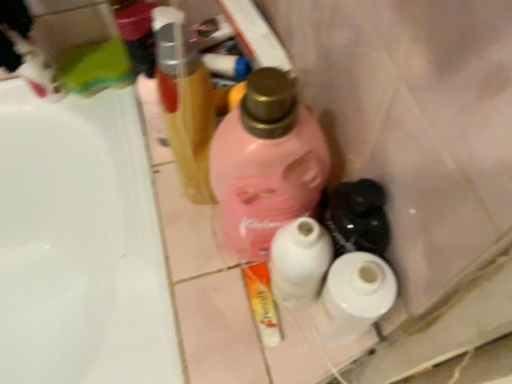
Identify the location of white matte toilet paper at center, acting as the first toilet paper starting from the right. (354, 296).

What do you see at coordinates (80, 245) in the screenshot? I see `white glossy sink at left` at bounding box center [80, 245].

The height and width of the screenshot is (384, 512). What do you see at coordinates (186, 108) in the screenshot? I see `metallic gold hairbrush at upper center, the second bottle positioned from the right` at bounding box center [186, 108].

Locate an element on the screen. metallic gold hairbrush at upper center, which appears as the 1th bottle when viewed from the left is located at coordinates (186, 108).

This screenshot has height=384, width=512. Describe the element at coordinates (266, 163) in the screenshot. I see `pink matte bottle at center, positioned as the 2th bottle in left-to-right order` at that location.

Identify the location of white matte toilet paper at center, the 1th toilet paper when ordered from left to right. The image size is (512, 384). (298, 262).

You are a GUI agent. You are given a task and a screenshot of the screen. Output one action in this format:
    pyautogui.click(x=<x>, y=<y>)
    Task: Click on the white glossy tube at center
    
    Given the screenshot: What is the action you would take?
    pyautogui.click(x=262, y=302)

Where is `white matte toilet paper at center, acting as the first toilet paper starting from the right`? The image size is (512, 384). white matte toilet paper at center, acting as the first toilet paper starting from the right is located at coordinates (354, 296).

The image size is (512, 384). In order to click on toilet paper that is the 1st object directly below the pink matte bottle at center, which is the 1th bottle from right to left (from a real-world perspective) in this screenshot , I will do `click(354, 296)`.

From a real-world perspective, is white matte toilet paper at center, acting as the first toilet paper starting from the right, located higher than pink matte bottle at center, positioned as the 2th bottle in left-to-right order?

No, from a real-world perspective, white matte toilet paper at center, acting as the first toilet paper starting from the right, is not over pink matte bottle at center, positioned as the 2th bottle in left-to-right order

Is white matte toilet paper at center, which is the 2th toilet paper from left to right, looking in the opposite direction of pink matte bottle at center, which is the 1th bottle from right to left?

No.

From the image's perspective, is white matte toilet paper at center, which is the 2th toilet paper from left to right, over pink matte bottle at center, positioned as the 2th bottle in left-to-right order?

No, from the image's perspective, white matte toilet paper at center, which is the 2th toilet paper from left to right, is not on top of pink matte bottle at center, positioned as the 2th bottle in left-to-right order.

The height and width of the screenshot is (384, 512). I want to click on sink located behind the pink matte bottle at center, which is the 1th bottle from right to left, so click(x=80, y=245).

Consider the image. Is pink matte bottle at center, positioned as the 2th bottle in left-to-right order, turned away from white glossy sink at left?

That's not correct — pink matte bottle at center, positioned as the 2th bottle in left-to-right order, is not looking away from white glossy sink at left.

Which of these two, pink matte bottle at center, which is the 1th bottle from right to left, or white glossy sink at left, stands shorter?

Standing shorter between the two is pink matte bottle at center, which is the 1th bottle from right to left.

Would you say white glossy sink at left is part of pink matte bottle at center, which is the 1th bottle from right to left,'s contents?

No.

Which is closer, (x=124, y=276) or (x=266, y=312)?

The point (x=266, y=312) is closer.

From a real-world perspective, is white glossy sink at left located higher than white glossy tube at center?

No.

Looking at this image, is white glossy sink at left facing away from white glossy tube at center?

That's not correct — white glossy sink at left is not looking away from white glossy tube at center.

Between white glossy sink at left and white glossy tube at center, which one has larger size?

With larger size is white glossy sink at left.

Could metallic gold hairbrush at upper center, which appears as the 1th bottle when viewed from the left, be considered to be inside white glossy sink at left?

No, metallic gold hairbrush at upper center, which appears as the 1th bottle when viewed from the left, is located outside of white glossy sink at left.

Does white glossy sink at left have a greater height compared to metallic gold hairbrush at upper center, the second bottle positioned from the right?

Indeed, white glossy sink at left has a greater height compared to metallic gold hairbrush at upper center, the second bottle positioned from the right.

Which point is more distant from viewer, [61,158] or [177,120]?

Answer: The point [61,158] is more distant.

Can you confirm if white glossy sink at left is wider than metallic gold hairbrush at upper center, which appears as the 1th bottle when viewed from the left?

Yes, white glossy sink at left is wider than metallic gold hairbrush at upper center, which appears as the 1th bottle when viewed from the left.

Which of these two, white matte toilet paper at center, which is the 2th toilet paper from left to right, or metallic gold hairbrush at upper center, which appears as the 1th bottle when viewed from the left, is smaller?

With smaller size is white matte toilet paper at center, which is the 2th toilet paper from left to right.

Can we say white matte toilet paper at center, which is the 2th toilet paper from left to right, lies outside metallic gold hairbrush at upper center, the second bottle positioned from the right?

Yes, white matte toilet paper at center, which is the 2th toilet paper from left to right, is outside of metallic gold hairbrush at upper center, the second bottle positioned from the right.

From the image's perspective, would you say white matte toilet paper at center, which is the 2th toilet paper from left to right, is positioned over metallic gold hairbrush at upper center, which appears as the 1th bottle when viewed from the left?

No, from the image's perspective, white matte toilet paper at center, which is the 2th toilet paper from left to right, is not above metallic gold hairbrush at upper center, which appears as the 1th bottle when viewed from the left.

From the image's perspective, which object appears higher, white matte toilet paper at center, which is the 2th toilet paper from left to right, or white matte toilet paper at center, the 1th toilet paper when ordered from left to right?

From the image's view, white matte toilet paper at center, the 1th toilet paper when ordered from left to right, is above.

Choose the correct answer: Is white matte toilet paper at center, which is the 2th toilet paper from left to right, inside white matte toilet paper at center, acting as the 2th toilet paper starting from the right, or outside it?

The correct answer is: outside.

Considering the sizes of objects metallic gold hairbrush at upper center, which appears as the 1th bottle when viewed from the left, and pink matte bottle at center, which is the 1th bottle from right to left, in the image provided, who is bigger, metallic gold hairbrush at upper center, which appears as the 1th bottle when viewed from the left, or pink matte bottle at center, which is the 1th bottle from right to left,?

With larger size is pink matte bottle at center, which is the 1th bottle from right to left.

Is metallic gold hairbrush at upper center, the second bottle positioned from the right, with pink matte bottle at center, positioned as the 2th bottle in left-to-right order?

Yes.

Does metallic gold hairbrush at upper center, the second bottle positioned from the right, have a lesser height compared to pink matte bottle at center, positioned as the 2th bottle in left-to-right order?

Correct, metallic gold hairbrush at upper center, the second bottle positioned from the right, is not as tall as pink matte bottle at center, positioned as the 2th bottle in left-to-right order.

I want to click on bottle lying on the left of pink matte bottle at center, positioned as the 2th bottle in left-to-right order, so click(186, 108).

The width and height of the screenshot is (512, 384). In order to click on the 1st toilet paper directly beneath the pink matte bottle at center, positioned as the 2th bottle in left-to-right order (from a real-world perspective) in this screenshot , I will do `click(354, 296)`.

At what (x,y) coordinates should I click in order to perform the action: click on sink on the left of pink matte bottle at center, positioned as the 2th bottle in left-to-right order. Please return your answer as a coordinate pair (x, y). The width and height of the screenshot is (512, 384). Looking at the image, I should click on (80, 245).

Which object lies nearer to the anchor point white glossy sink at left, white matte toilet paper at center, the 1th toilet paper when ordered from left to right, or pink matte bottle at center, which is the 1th bottle from right to left?

pink matte bottle at center, which is the 1th bottle from right to left, is positioned closer to the anchor white glossy sink at left.

From the image, which object appears to be farther from pink matte bottle at center, which is the 1th bottle from right to left, white matte toilet paper at center, the 1th toilet paper when ordered from left to right, or white glossy tube at center?

white glossy tube at center is positioned further to the anchor pink matte bottle at center, which is the 1th bottle from right to left.

Looking at the image, which one is located closer to white matte toilet paper at center, acting as the 2th toilet paper starting from the right, pink matte bottle at center, positioned as the 2th bottle in left-to-right order, or white glossy tube at center?

pink matte bottle at center, positioned as the 2th bottle in left-to-right order, is closer to white matte toilet paper at center, acting as the 2th toilet paper starting from the right.

Based on the photo, from the image, which object appears to be nearer to white matte toilet paper at center, which is the 2th toilet paper from left to right, metallic gold hairbrush at upper center, the second bottle positioned from the right, or white glossy sink at left?

Among the two, metallic gold hairbrush at upper center, the second bottle positioned from the right, is located nearer to white matte toilet paper at center, which is the 2th toilet paper from left to right.

Considering their positions, is pink matte bottle at center, positioned as the 2th bottle in left-to-right order, positioned closer to white matte toilet paper at center, the 1th toilet paper when ordered from left to right, than white glossy sink at left?

Based on the image, pink matte bottle at center, positioned as the 2th bottle in left-to-right order, appears to be nearer to white matte toilet paper at center, the 1th toilet paper when ordered from left to right.

Looking at the image, which one is located further to white glossy sink at left, white glossy tube at center or white matte toilet paper at center, acting as the 2th toilet paper starting from the right?

white matte toilet paper at center, acting as the 2th toilet paper starting from the right, is further to white glossy sink at left.

Looking at the image, which one is located further to white matte toilet paper at center, which is the 2th toilet paper from left to right, metallic gold hairbrush at upper center, which appears as the 1th bottle when viewed from the left, or white matte toilet paper at center, acting as the 2th toilet paper starting from the right?

metallic gold hairbrush at upper center, which appears as the 1th bottle when viewed from the left, is further to white matte toilet paper at center, which is the 2th toilet paper from left to right.

Looking at this image, which object lies further to the anchor point white glossy tube at center, white matte toilet paper at center, which is the 2th toilet paper from left to right, or pink matte bottle at center, positioned as the 2th bottle in left-to-right order?

Among the two, pink matte bottle at center, positioned as the 2th bottle in left-to-right order, is located further to white glossy tube at center.

At what (x,y) coordinates should I click in order to perform the action: click on bottle that lies between metallic gold hairbrush at upper center, the second bottle positioned from the right, and white matte toilet paper at center, acting as the first toilet paper starting from the right, from top to bottom. Please return your answer as a coordinate pair (x, y). The width and height of the screenshot is (512, 384). Looking at the image, I should click on (266, 163).

Find the location of a particular element. The image size is (512, 384). bottle between metallic gold hairbrush at upper center, the second bottle positioned from the right, and white glossy tube at center from top to bottom is located at coordinates click(266, 163).

The height and width of the screenshot is (384, 512). I want to click on toothpaste located between white glossy sink at left and white matte toilet paper at center, which is the 2th toilet paper from left to right, in the left-right direction, so click(x=262, y=302).

The height and width of the screenshot is (384, 512). In order to click on bottle between white glossy sink at left and pink matte bottle at center, positioned as the 2th bottle in left-to-right order, from left to right in this screenshot , I will do `click(186, 108)`.